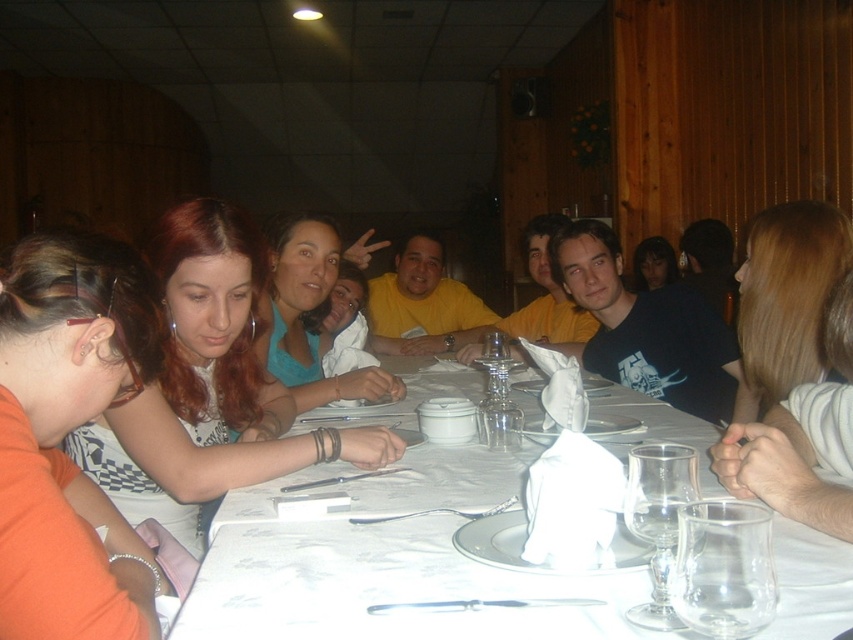
Based on the photo, you are a server in the restaurant and need to place a new drink order for the person wearing the teal matte shirt at center. Where should you place the drink relative to the transparent glass at table center?

The teal matte shirt at center is located above the transparent glass at table center, so you should place the drink below the transparent glass at table center to avoid blocking the shirt.

You are a server at the restaurant and need to place a new drink order for the guest wearing the teal matte shirt at center. Where should you place the drink relative to the transparent glass wine glass at lower center?

You should place the drink to the right of the transparent glass wine glass at lower center since the teal matte shirt at center is to the left of the transparent glass wine glass at lower center.

Based on the scene description, where is the teal matte shirt at center located in terms of coordinates?

The teal matte shirt at center is located at coordinates point (310, 317).